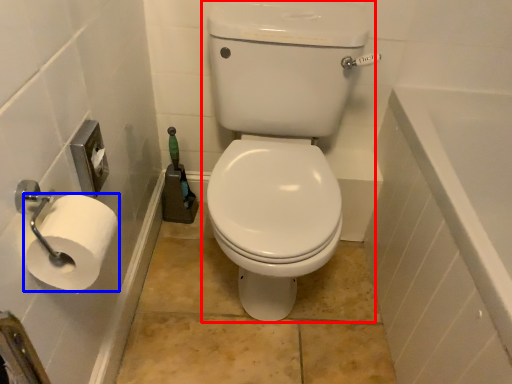
Question: Among these objects, which one is nearest to the camera, sit (highlighted by a red box) or toilet paper (highlighted by a blue box)?

Choices:
 (A) sit
 (B) toilet paper

Answer: (B)